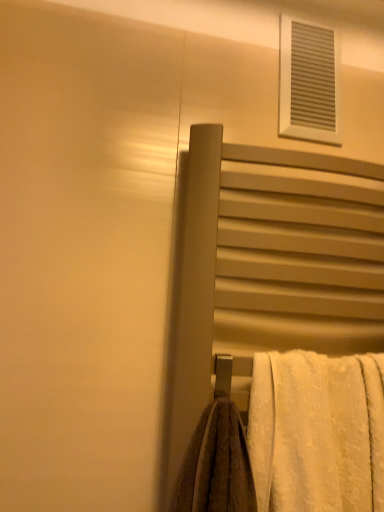
In order to click on white fluffy towel at lower right in this screenshot , I will do `click(317, 432)`.

Is matte gray towel rack at center-right positioned with its back to white fluffy towel at lower right?

Yes, matte gray towel rack at center-right's orientation is away from white fluffy towel at lower right.

Between matte gray towel rack at center-right and white fluffy towel at lower right, which one appears on the right side from the viewer's perspective?

From the viewer's perspective, white fluffy towel at lower right appears more on the right side.

From the image's perspective, is matte gray towel rack at center-right on white fluffy towel at lower right?

Yes, from the image's perspective, matte gray towel rack at center-right is over white fluffy towel at lower right.

Is there a large distance between matte gray towel rack at center-right and white fluffy towel at lower right?

That's not correct — matte gray towel rack at center-right is a little close to white fluffy towel at lower right.

Between white textured vent at upper right and white fluffy towel at lower right, which one has smaller width?

Thinner between the two is white textured vent at upper right.

Between white textured vent at upper right and white fluffy towel at lower right, which one has larger size?

With larger size is white fluffy towel at lower right.

From the image's perspective, would you say white textured vent at upper right is positioned over white fluffy towel at lower right?

Yes.

From the picture: Is matte gray towel rack at center-right directly adjacent to white textured vent at upper right?

No.

Do you think matte gray towel rack at center-right is within white textured vent at upper right, or outside of it?

matte gray towel rack at center-right is not inside white textured vent at upper right, it's outside.

Does point (336, 244) come closer to viewer compared to point (309, 83)?

Yes, point (336, 244) is closer to viewer.

From the image's perspective, between matte gray towel rack at center-right and white textured vent at upper right, which one is located above?

white textured vent at upper right.

In the scene shown: Considering the sizes of objects white fluffy towel at lower right and white textured vent at upper right in the image provided, who is bigger, white fluffy towel at lower right or white textured vent at upper right?

Bigger between the two is white fluffy towel at lower right.

Are white fluffy towel at lower right and white textured vent at upper right beside each other?

There is a gap between white fluffy towel at lower right and white textured vent at upper right.

From the image's perspective, is white fluffy towel at lower right under white textured vent at upper right?

Yes, from the image's perspective, white fluffy towel at lower right is beneath white textured vent at upper right.

Can we say white fluffy towel at lower right lies outside white textured vent at upper right?

white fluffy towel at lower right lies outside white textured vent at upper right's area.

Based on the photo, who is shorter, white textured vent at upper right or matte gray towel rack at center-right?

white textured vent at upper right is shorter.

Can you tell me how much white textured vent at upper right and matte gray towel rack at center-right differ in facing direction?

1.13 degrees.

Can you see white textured vent at upper right touching matte gray towel rack at center-right?

white textured vent at upper right and matte gray towel rack at center-right are clearly separated.

Is white textured vent at upper right facing away from matte gray towel rack at center-right?

No, white textured vent at upper right is not facing the opposite direction of matte gray towel rack at center-right.

Where is `screen door that appears on the left of white fluffy towel at lower right`? screen door that appears on the left of white fluffy towel at lower right is located at coordinates (264, 275).

Consider the image. From the image's perspective, which one is positioned higher, white fluffy towel at lower right or matte gray towel rack at center-right?

matte gray towel rack at center-right is shown above in the image.

Considering the relative sizes of white fluffy towel at lower right and matte gray towel rack at center-right in the image provided, is white fluffy towel at lower right thinner than matte gray towel rack at center-right?

Incorrect, the width of white fluffy towel at lower right is not less than that of matte gray towel rack at center-right.

Is white fluffy towel at lower right located outside matte gray towel rack at center-right?

Actually, white fluffy towel at lower right is within matte gray towel rack at center-right.

Where is `screen door above the white fluffy towel at lower right (from the image's perspective)`? The image size is (384, 512). screen door above the white fluffy towel at lower right (from the image's perspective) is located at coordinates (x=264, y=275).

The image size is (384, 512). I want to click on window located behind the white fluffy towel at lower right, so click(309, 82).

When comparing their distances from matte gray towel rack at center-right, does white textured vent at upper right or white fluffy towel at lower right seem closer?

Among the two, white fluffy towel at lower right is located nearer to matte gray towel rack at center-right.

Looking at the image, which one is located closer to white fluffy towel at lower right, white textured vent at upper right or matte gray towel rack at center-right?

matte gray towel rack at center-right is closer to white fluffy towel at lower right.

Which object lies further to the anchor point white textured vent at upper right, white fluffy towel at lower right or matte gray towel rack at center-right?

Result: The object further to white textured vent at upper right is white fluffy towel at lower right.

Estimate the real-world distances between objects in this image. Which object is closer to white fluffy towel at lower right, matte gray towel rack at center-right or white textured vent at upper right?

Based on the image, matte gray towel rack at center-right appears to be nearer to white fluffy towel at lower right.

Which object lies nearer to the anchor point matte gray towel rack at center-right, white fluffy towel at lower right or white textured vent at upper right?

white fluffy towel at lower right is closer to matte gray towel rack at center-right.

When comparing their distances from white textured vent at upper right, does matte gray towel rack at center-right or white fluffy towel at lower right seem further?

The object further to white textured vent at upper right is white fluffy towel at lower right.

Identify the location of screen door between white textured vent at upper right and white fluffy towel at lower right in the up-down direction. (264, 275).